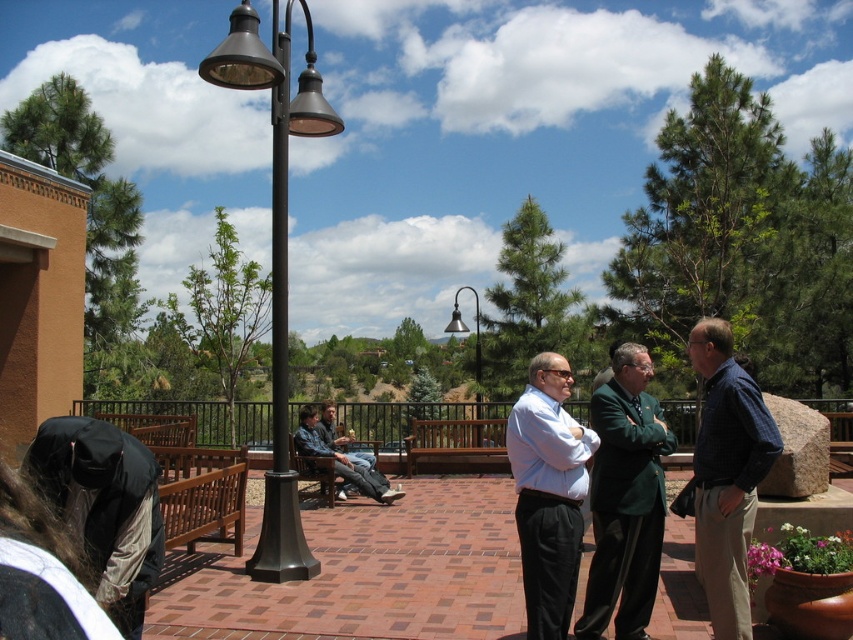
Question: Which object appears farthest from the camera in this image?

Choices:
 (A) green fabric jacket at center
 (B) blue plaid shirt at right
 (C) light blue shirt at center

Answer: (A)

Question: Considering the relative positions of green fabric jacket at center and denim jacket at center in the image provided, where is green fabric jacket at center located with respect to denim jacket at center?

Choices:
 (A) left
 (B) right

Answer: (B)

Question: Observing the image, what is the correct spatial positioning of black metal lamp post at center in reference to green fabric jacket at center?

Choices:
 (A) below
 (B) above

Answer: (B)

Question: Which object is the farthest from the metallic lamp post at center?

Choices:
 (A) black metal lamp post at center
 (B) blue plaid shirt at right
 (C) green fabric jacket at center

Answer: (B)

Question: Which object is closer to the camera taking this photo?

Choices:
 (A) denim jacket at center
 (B) blue plaid shirt at right

Answer: (B)

Question: Does blue plaid shirt at right have a greater width compared to light blue shirt at center?

Choices:
 (A) no
 (B) yes

Answer: (A)